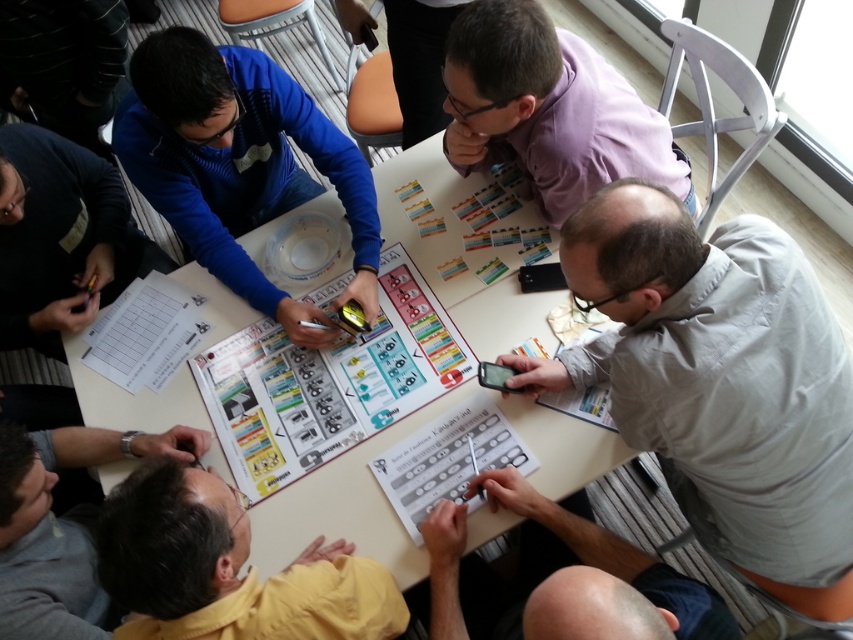
You are a game organizer and need to place a new rulebook between the gray fabric shirt at lower right and the matte plastic board game at center. Based on their current positions, which object should the rulebook be closer to?

The gray fabric shirt at lower right is positioned on the right side of the matte plastic board game at center. Therefore, the rulebook should be placed closer to the matte plastic board game at center to maintain the spatial arrangement between the two objects.

You are standing at the edge of the table where the board game is set up. There is a specific point marked at coordinates point (x=630, y=116). If you want to reach this point without moving your body, can you just stretch your hand out normally?

The point (x=630, y=116) is 4.23 feet away from camera, so no, you cannot reach it by just stretching your hand normally since the average human arm length is about 2.5 feet.

You are a game organizer checking the seating arrangement for the next round. You need to ensure that the purple matte shirt at upper center and the smooth gray shirt at lower right can both fit on the new table that is 1.2 meters wide. Given their sizes, will they both fit comfortably?

The purple matte shirt at upper center is wider than the smooth gray shirt at lower right. Since the purple matte shirt at upper center is the larger of the two and its width is not specified, but the total width of both combined would need to be less than 1.2 meters. However, without exact measurements, it is impossible to determine if they will both fit comfortably on the new table that is 1.2 meters wide.